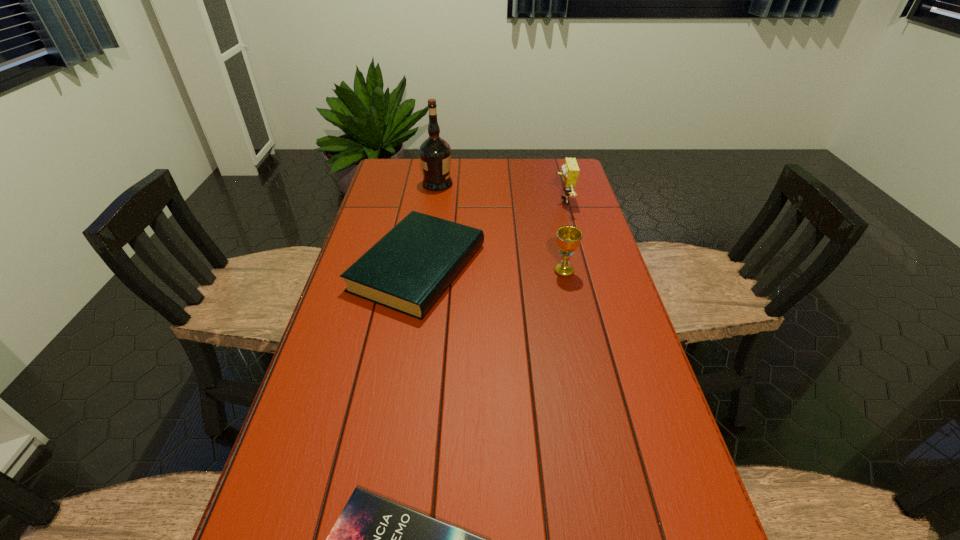
In the image, there is a desktop. Find the location of `vacant space at the far left corner`. vacant space at the far left corner is located at coordinates (397, 160).

Where is `empty space between the chalice and the farther hardback book`? This screenshot has width=960, height=540. empty space between the chalice and the farther hardback book is located at coordinates (491, 269).

I want to click on vacant space in between the chalice and the liquor, so click(x=501, y=228).

What are the coordinates of `free space between the taller hardback book and the chalice` in the screenshot? It's located at (491, 269).

The image size is (960, 540). I want to click on empty space that is in between the liquor and the sponge, so click(x=500, y=193).

This screenshot has height=540, width=960. What are the coordinates of `free space between the chalice and the farther hardback book` in the screenshot? It's located at (491, 269).

Locate an element on the screen. Image resolution: width=960 pixels, height=540 pixels. free area in between the second shortest object and the chalice is located at coordinates (491, 269).

Where is `object that is the fourth closest to the fourth tallest object`? The image size is (960, 540). object that is the fourth closest to the fourth tallest object is located at coordinates (374, 539).

At what (x,y) coordinates should I click in order to perform the action: click on the third closest object to the sponge. Please return your answer as a coordinate pair (x, y). Looking at the image, I should click on (435, 153).

Locate an element on the screen. Image resolution: width=960 pixels, height=540 pixels. vacant region that satisfies the following two spatial constraints: 1. on the surface of the tallest object; 2. on the right side of the chalice is located at coordinates pos(424,272).